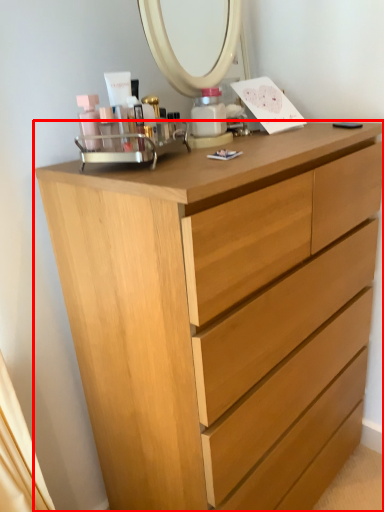
Question: In this image, where is chest of drawers (annotated by the red box) located relative to toiletry?

Choices:
 (A) right
 (B) left

Answer: (A)